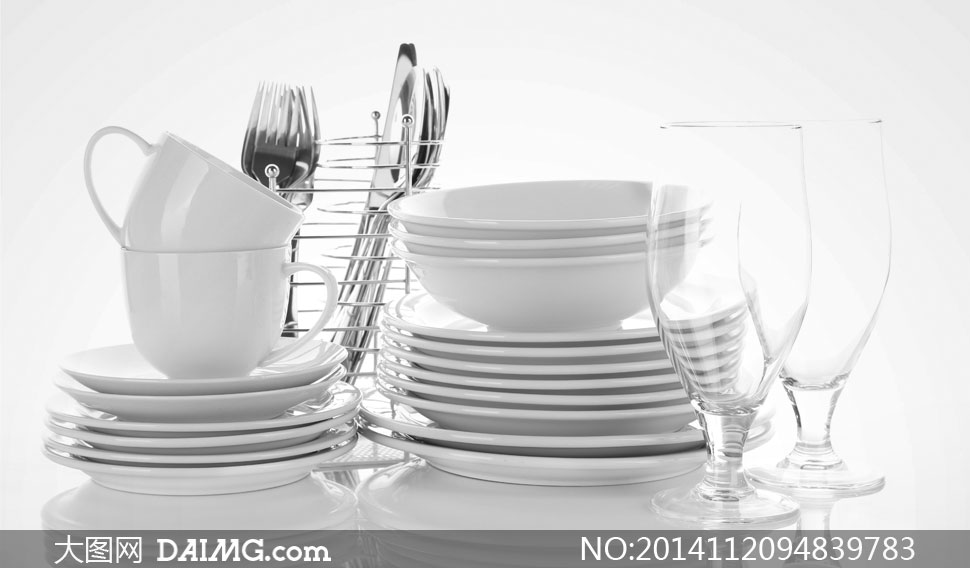
Locate an element on the screen. The image size is (970, 568). plates on left side is located at coordinates (267, 377), (266, 390), (268, 420), (267, 429), (271, 450), (271, 465).